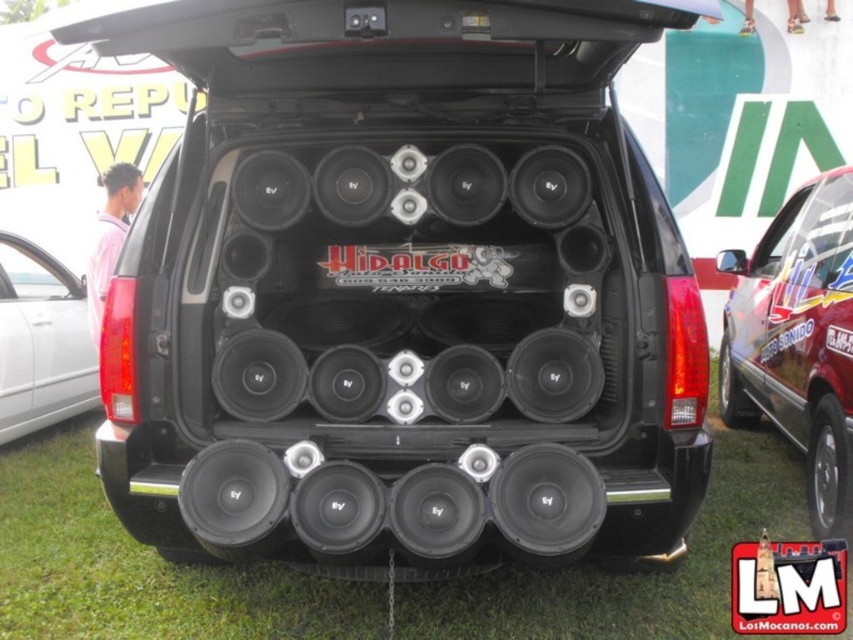
Can you confirm if black matte speaker at lower left is wider than black plastic license plate at center?

Indeed, black matte speaker at lower left has a greater width compared to black plastic license plate at center.

Measure the distance between black matte speaker at lower left and black plastic license plate at center.

17.12 feet

Locate an element on the screen. The height and width of the screenshot is (640, 853). black matte speaker at lower left is located at coordinates (41, 340).

Can you confirm if green grass at lower center is wider than shiny metallic car at right?

Correct, the width of green grass at lower center exceeds that of shiny metallic car at right.

Who is higher up, green grass at lower center or shiny metallic car at right?

shiny metallic car at right

Does point (792, 484) come behind point (724, 362)?

No, (792, 484) is closer to viewer.

The height and width of the screenshot is (640, 853). I want to click on green grass at lower center, so click(138, 566).

Between point (769, 324) and point (62, 298), which one is positioned in front?

Positioned in front is point (769, 324).

Locate an element on the screen. The image size is (853, 640). shiny metallic car at right is located at coordinates (798, 340).

Find the location of a particular element. Image resolution: width=853 pixels, height=640 pixels. shiny metallic car at right is located at coordinates (798, 340).